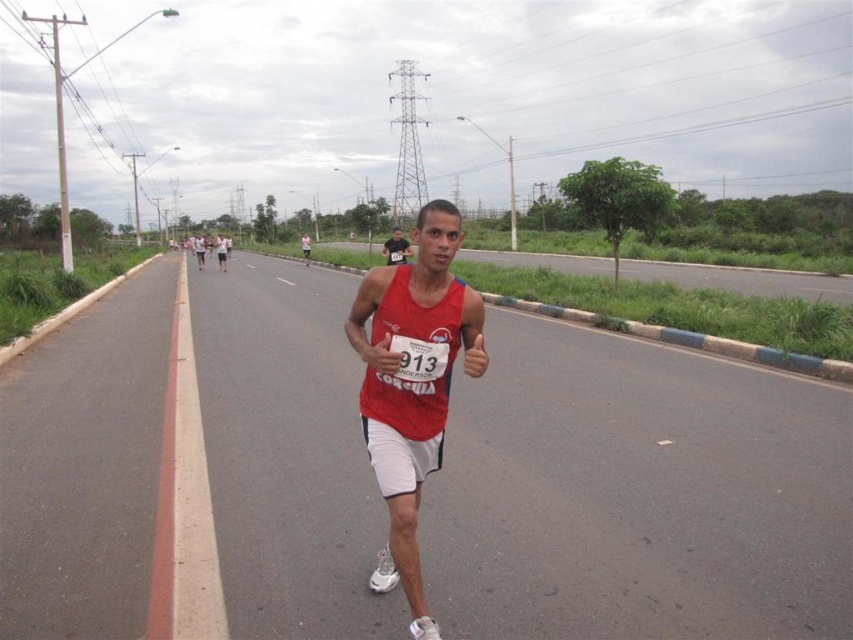
Does red matte tank top at center appear over matte red tank top at center?

No.

Between point (408, 452) and point (393, 248), which one is positioned in front?

Point (408, 452) is more forward.

Locate an element on the screen. This screenshot has height=640, width=853. red matte tank top at center is located at coordinates (412, 385).